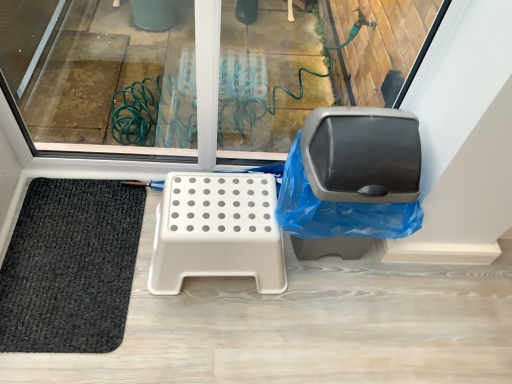
You are a GUI agent. You are given a task and a screenshot of the screen. Output one action in this format:
    pyautogui.click(x=<x>, y=<y>)
    Task: Click on the vacant area that is in front of matte gray swivel chair at right
    The width and height of the screenshot is (512, 384).
    Given the screenshot: What is the action you would take?
    [316, 324]